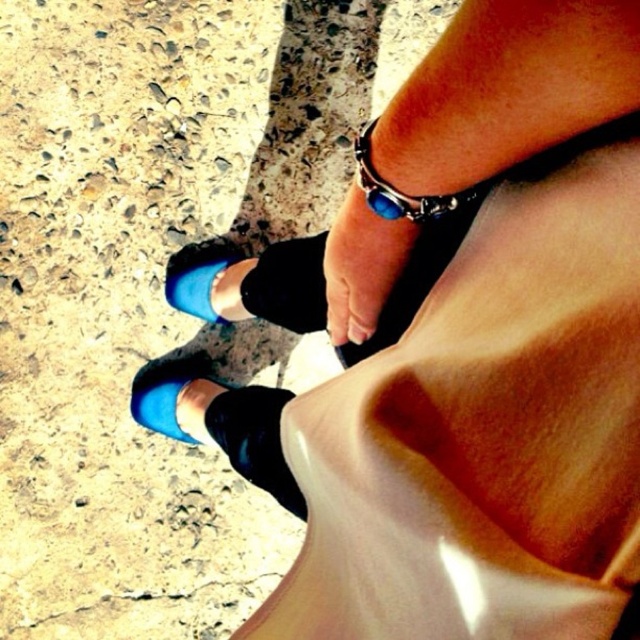
You are a photographer trying to capture a detailed shot of both the blue suede sandal at lower left and the blue suede shoe at lower center. Based on their positions, which one should you focus on first to ensure it appears sharp in the final image?

The blue suede sandal at lower left is below the blue suede shoe at lower center, so you should focus on the blue suede shoe at lower center first since it is closer to the camera and will be in focus before adjusting for the sandal further back.

Looking at the scene with the blue suede sandal at lower left and the blue suede shoe at lower center, which one is positioned to the right?

The blue suede shoe at lower center is positioned to the right of the blue suede sandal at lower left.

You are a fashion designer observing two lower legs on a pavement. You need to determine which object is wider between the black leather ankle at lower center and the blue suede shoe at lower center. Based on the scene, which one is wider?

The black leather ankle at lower center is wider than the blue suede shoe at lower center according to the description.